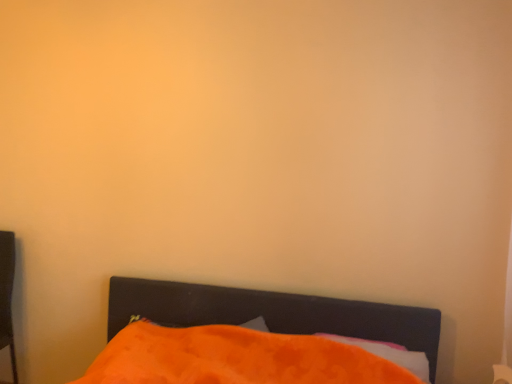
Question: In the image, is orange fabric pillow at lower center positioned in front of or behind orange fabric bed at lower center?

Choices:
 (A) behind
 (B) front

Answer: (A)

Question: From a real-world perspective, is orange fabric pillow at lower center positioned above or below orange fabric bed at lower center?

Choices:
 (A) below
 (B) above

Answer: (B)

Question: From the image's perspective, is orange fabric pillow at lower center positioned above or below orange fabric bed at lower center?

Choices:
 (A) below
 (B) above

Answer: (B)

Question: Is orange fabric bed at lower center in front of or behind orange fabric pillow at lower center in the image?

Choices:
 (A) behind
 (B) front

Answer: (B)

Question: Is orange fabric bed at lower center spatially inside orange fabric pillow at lower center, or outside of it?

Choices:
 (A) inside
 (B) outside

Answer: (B)

Question: From a real-world perspective, is orange fabric bed at lower center above or below orange fabric pillow at lower center?

Choices:
 (A) above
 (B) below

Answer: (B)

Question: Considering the positions of orange fabric bed at lower center and orange fabric pillow at lower center in the image, is orange fabric bed at lower center taller or shorter than orange fabric pillow at lower center?

Choices:
 (A) tall
 (B) short

Answer: (A)